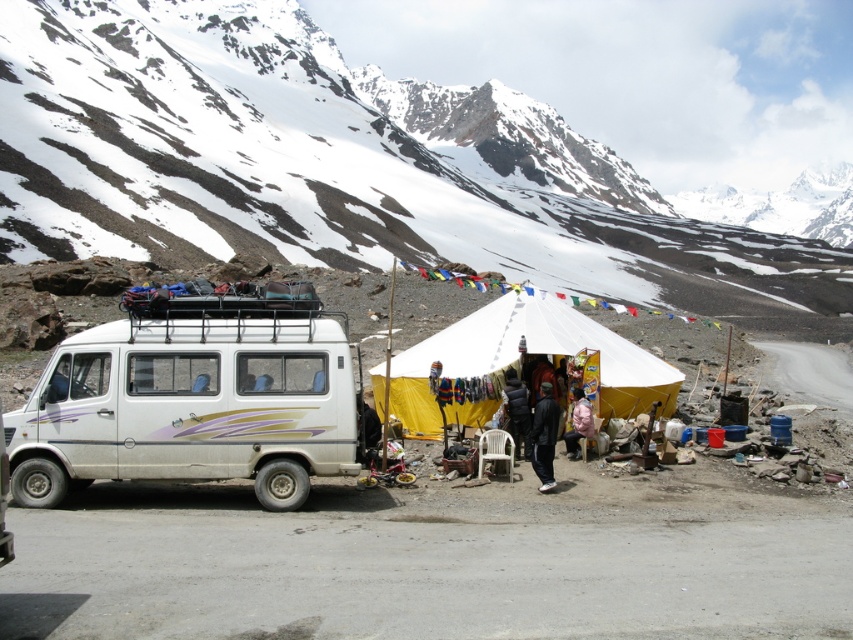
You are standing in front of the van and want to take a photo of both the van and the tent. You notice two points marked in the scene, point (550, 394) and point (579, 413). Which point is closer to your camera when focusing on the van?

Point (550, 394) is further to the camera than point (579, 413), so the point closer to your camera when focusing on the van is point (579, 413).

You are a traveler standing near the van and tent. You see a black leather jacket at center and a pink fabric person at center. Which object is closer to the ground?

The black leather jacket at center is located below the pink fabric person at center, so it is closer to the ground.

You are a traveler who wants to store your black leather jacket at center in the trunk of the white matte van at left. Based on the scene description, will the jacket fit inside the trunk?

The white matte van at left has a larger size compared to the black leather jacket at center, so the jacket should fit inside the trunk.